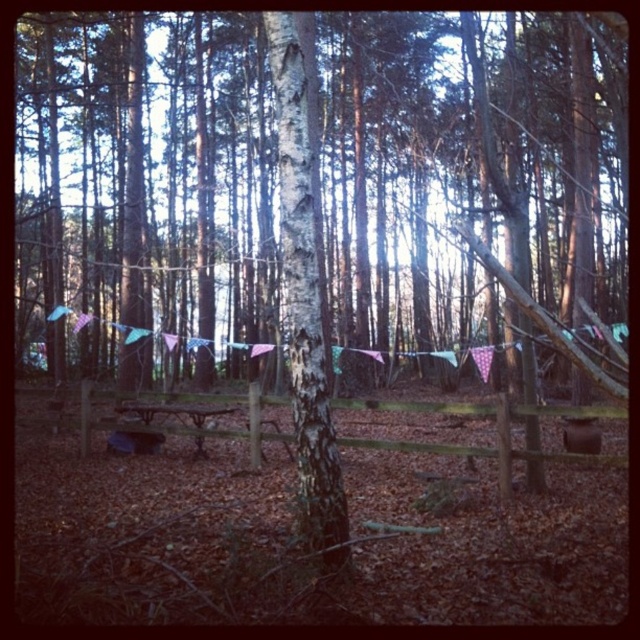
Question: Which object is farther from the camera taking this photo?

Choices:
 (A) wooden picnic table at center
 (B) white bark tree at center

Answer: (A)

Question: Which object appears closest to the camera in this image?

Choices:
 (A) wooden picnic table at center
 (B) white bark tree at center

Answer: (B)

Question: Is white bark tree at center bigger than wooden picnic table at center?

Choices:
 (A) no
 (B) yes

Answer: (A)

Question: Is white bark tree at center thinner than wooden picnic table at center?

Choices:
 (A) yes
 (B) no

Answer: (A)

Question: Is white bark tree at center wider than wooden picnic table at center?

Choices:
 (A) no
 (B) yes

Answer: (A)